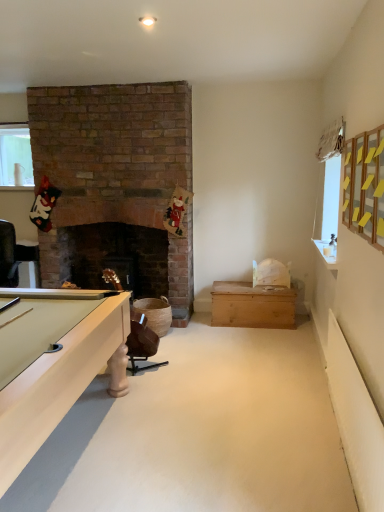
Question: Is brown leather chair at lower center in front of white glossy counter top at upper right?

Choices:
 (A) no
 (B) yes

Answer: (A)

Question: Would you say brown leather chair at lower center contains white glossy counter top at upper right?

Choices:
 (A) yes
 (B) no

Answer: (B)

Question: Is brown leather chair at lower center behind white glossy counter top at upper right?

Choices:
 (A) no
 (B) yes

Answer: (B)

Question: From a real-world perspective, is brown leather chair at lower center under white glossy counter top at upper right?

Choices:
 (A) yes
 (B) no

Answer: (A)

Question: Is brown leather chair at lower center far away from white glossy counter top at upper right?

Choices:
 (A) yes
 (B) no

Answer: (A)

Question: Is brown leather chair at lower center taller than white glossy counter top at upper right?

Choices:
 (A) no
 (B) yes

Answer: (B)

Question: Is wooden chest at center completely or partially outside of white glossy counter top at upper right?

Choices:
 (A) yes
 (B) no

Answer: (A)

Question: Does wooden chest at center have a lesser width compared to white glossy counter top at upper right?

Choices:
 (A) no
 (B) yes

Answer: (A)

Question: Does wooden chest at center turn towards white glossy counter top at upper right?

Choices:
 (A) no
 (B) yes

Answer: (A)

Question: Is wooden chest at center oriented away from white glossy counter top at upper right?

Choices:
 (A) yes
 (B) no

Answer: (B)

Question: Are wooden chest at center and white glossy counter top at upper right located far from each other?

Choices:
 (A) yes
 (B) no

Answer: (A)

Question: Considering the relative sizes of wooden chest at center and white glossy counter top at upper right in the image provided, is wooden chest at center smaller than white glossy counter top at upper right?

Choices:
 (A) no
 (B) yes

Answer: (A)

Question: From a real-world perspective, is white glossy counter top at upper right located beneath clear glass vase at upper left?

Choices:
 (A) no
 (B) yes

Answer: (B)